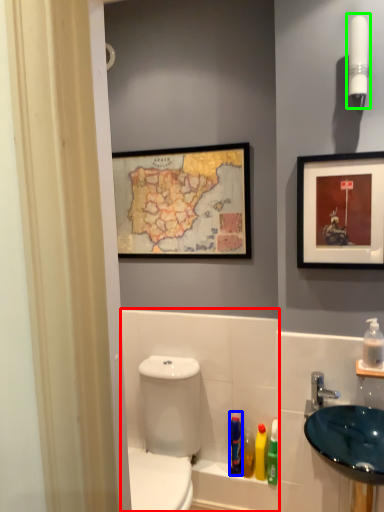
Question: Estimate the real-world distances between objects in this image. Which object is farther from bath (highlighted by a red box), mouthwash (highlighted by a blue box) or light fixture (highlighted by a green box)?

Choices:
 (A) mouthwash
 (B) light fixture

Answer: (B)